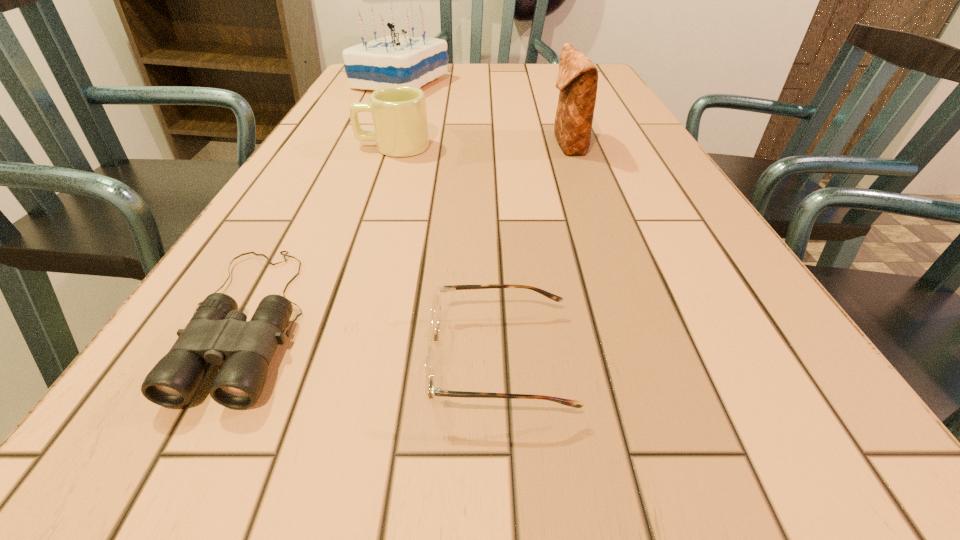
Locate an element on the screen. This screenshot has height=540, width=960. birthday cake is located at coordinates (394, 60).

The width and height of the screenshot is (960, 540). I want to click on the rightmost object, so click(577, 80).

Image resolution: width=960 pixels, height=540 pixels. In order to click on mug in this screenshot , I will do `click(399, 114)`.

The width and height of the screenshot is (960, 540). What are the coordinates of `the second object from right to left` in the screenshot? It's located at (432, 335).

This screenshot has width=960, height=540. What are the coordinates of `binoculars` in the screenshot? It's located at 217,333.

Where is `free space located on the front of the farthest object`? Image resolution: width=960 pixels, height=540 pixels. free space located on the front of the farthest object is located at coordinates (372, 151).

This screenshot has width=960, height=540. Find the location of `free space located on the open side of the clutch bag`. free space located on the open side of the clutch bag is located at coordinates (452, 145).

Image resolution: width=960 pixels, height=540 pixels. Find the location of `vacant space located on the open side of the clutch bag`. vacant space located on the open side of the clutch bag is located at coordinates (425, 145).

Find the location of a particular element. The height and width of the screenshot is (540, 960). free space located 0.180m on the open side of the clutch bag is located at coordinates (470, 145).

Locate an element on the screen. The image size is (960, 540). vacant space located 0.070m with the handle on the side of the third tallest object is located at coordinates (324, 147).